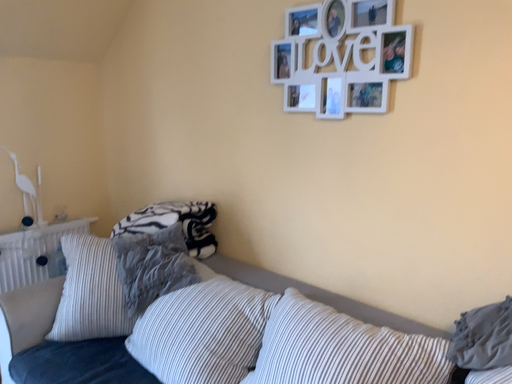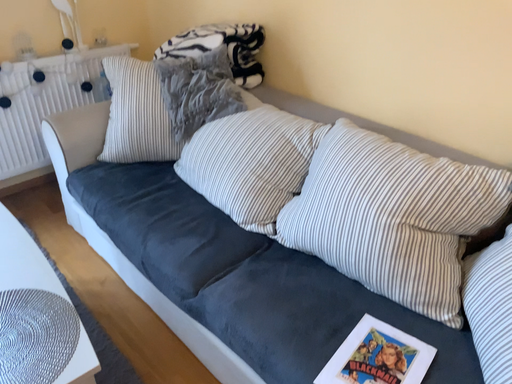
Question: How did the camera likely rotate when shooting the video?

Choices:
 (A) rotated upward
 (B) rotated downward

Answer: (B)